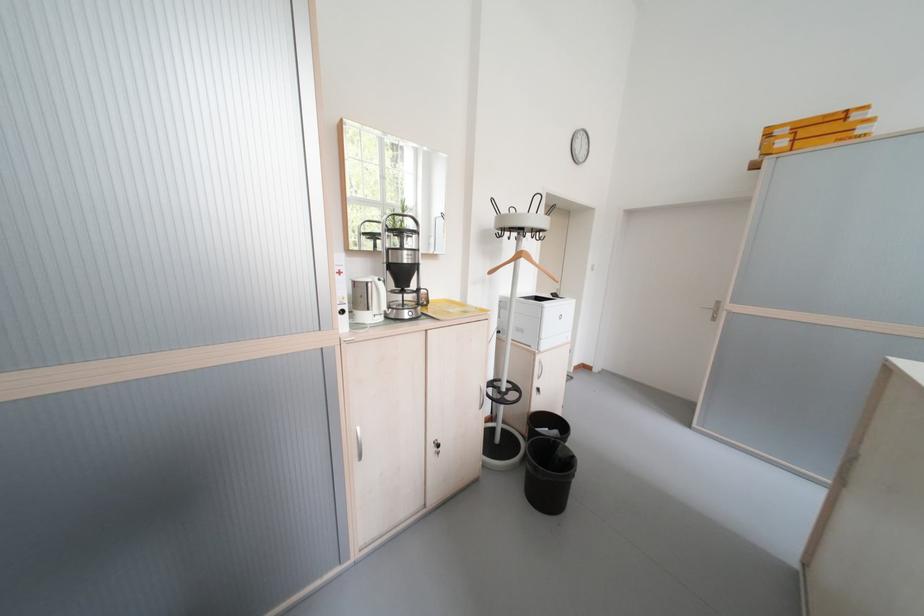
Where is `silver cabinet lock`? Image resolution: width=924 pixels, height=616 pixels. silver cabinet lock is located at coordinates (435, 447).